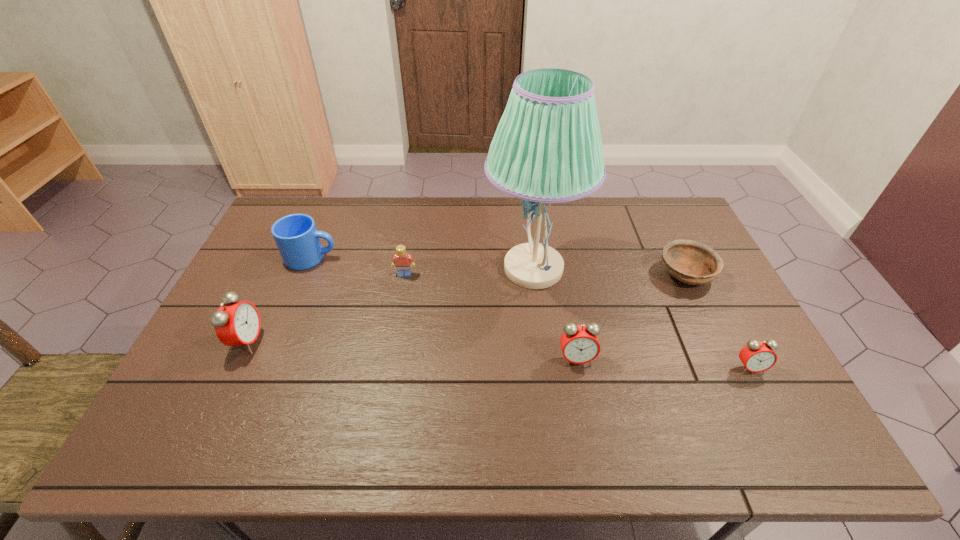
In the image, there is a desktop. Where is `vacant space at the far edge`? The image size is (960, 540). vacant space at the far edge is located at coordinates (611, 199).

In the image, there is a desktop. At what (x,y) coordinates should I click in order to perform the action: click on vacant space at the near edge. Please return your answer as a coordinate pair (x, y). The height and width of the screenshot is (540, 960). Looking at the image, I should click on (461, 382).

The image size is (960, 540). I want to click on blank area at the right edge, so click(x=714, y=354).

In the image, there is a desktop. Where is `vacant space at the far right corner`? Image resolution: width=960 pixels, height=540 pixels. vacant space at the far right corner is located at coordinates (652, 235).

This screenshot has width=960, height=540. In order to click on vacant region at the near right corner of the desktop in this screenshot , I will do `click(742, 401)`.

Locate an element on the screen. The width and height of the screenshot is (960, 540). empty location between the Lego and the second tallest alarm clock is located at coordinates (491, 317).

Find the location of a particular element. vacant space that is in between the tallest alarm clock and the second alarm clock from left to right is located at coordinates [412, 350].

Locate an element on the screen. This screenshot has height=540, width=960. free space between the mug and the third object from left to right is located at coordinates (358, 266).

Locate an element on the screen. The image size is (960, 540). blank region between the leftmost alarm clock and the shortest object is located at coordinates (467, 308).

Identify the location of vacant area that lies between the second shortest alarm clock and the mug. The width and height of the screenshot is (960, 540). (444, 308).